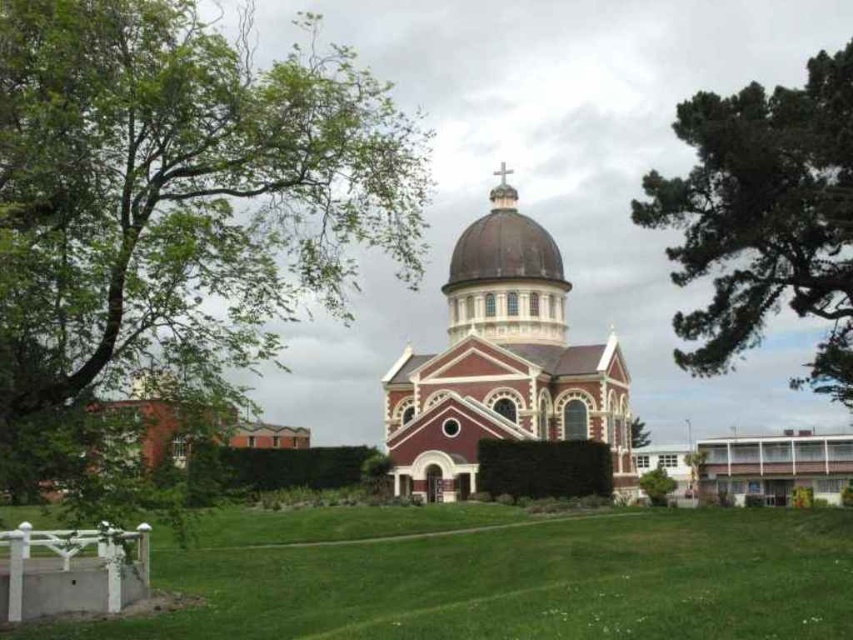
Question: Can you confirm if green needle-like leaves at upper right is positioned to the left of green leafy tree at center?

Choices:
 (A) no
 (B) yes

Answer: (A)

Question: Which point is closer to the camera taking this photo?

Choices:
 (A) (503, 179)
 (B) (0, 538)

Answer: (B)

Question: Among these points, which one is nearest to the camera?

Choices:
 (A) (635, 445)
 (B) (119, 548)
 (C) (653, 476)

Answer: (B)

Question: Does green grass at center have a smaller size compared to green needle-like leaves at upper right?

Choices:
 (A) yes
 (B) no

Answer: (A)

Question: Which object appears closest to the camera in this image?

Choices:
 (A) green needle-like leaves at upper right
 (B) green leafy tree at center
 (C) smooth gold dome at center

Answer: (A)

Question: Does green leafy tree at upper left appear on the right side of red brick church at center?

Choices:
 (A) yes
 (B) no

Answer: (B)